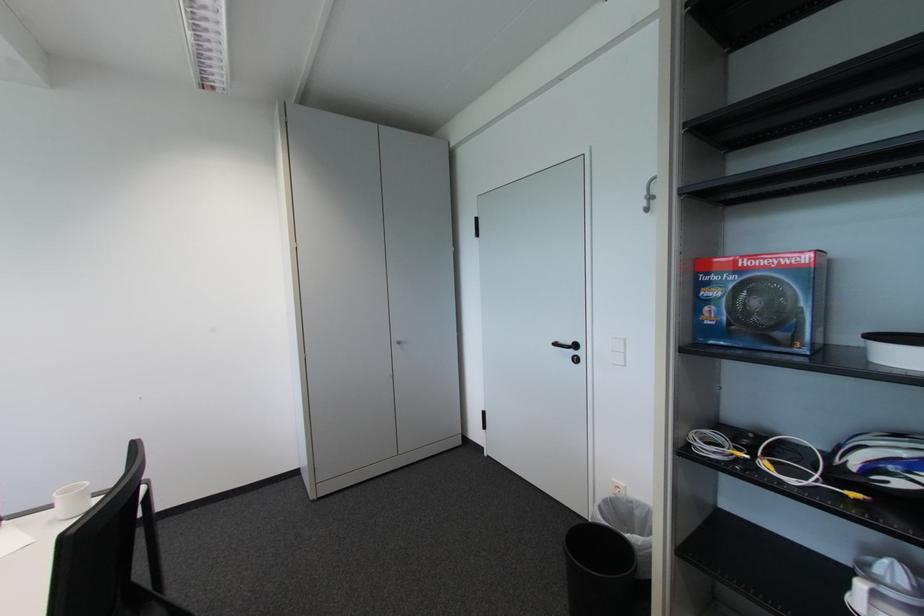
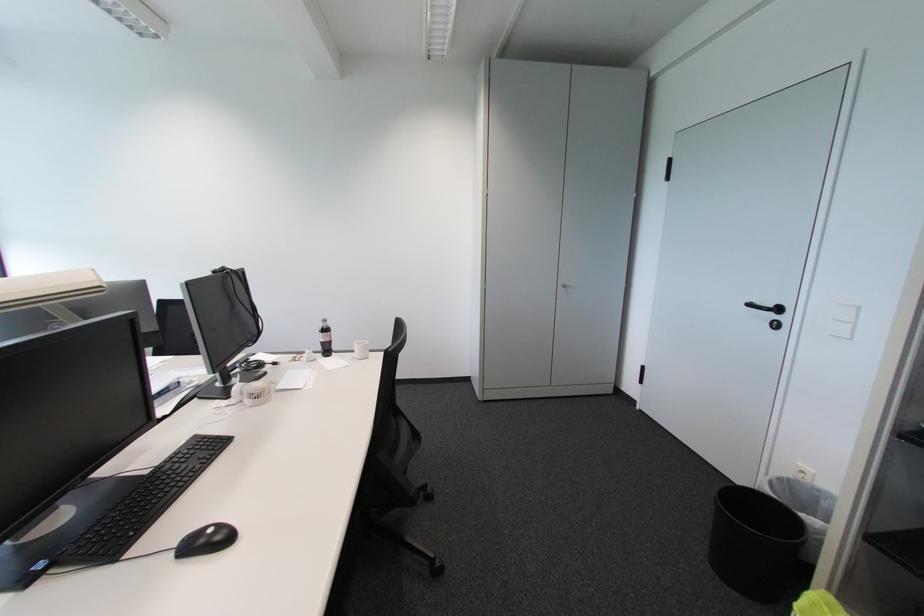
Where in the second image is the point corresponding to (625,492) from the first image?

(809, 477)